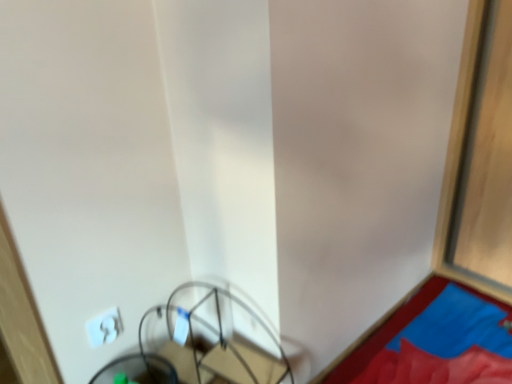
Question: Choose the correct answer: Is white plastic light switch at lower left inside blue fabric at lower right or outside it?

Choices:
 (A) inside
 (B) outside

Answer: (B)

Question: In the image, is white plastic light switch at lower left on the left side or the right side of blue fabric at lower right?

Choices:
 (A) left
 (B) right

Answer: (A)

Question: Based on their relative distances, which object is nearer to the blue fabric at lower right?

Choices:
 (A) metallic wire swivel chair at lower left
 (B) metal wire basket at lower center
 (C) white plastic light switch at lower left

Answer: (B)

Question: Which of these objects is positioned farthest from the metallic wire swivel chair at lower left?

Choices:
 (A) blue fabric at lower right
 (B) white plastic light switch at lower left
 (C) metal wire basket at lower center

Answer: (A)